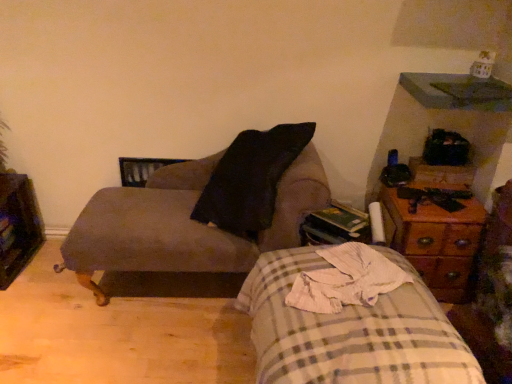
I want to click on free space in front of suede-like brown chair at upper left, so click(156, 348).